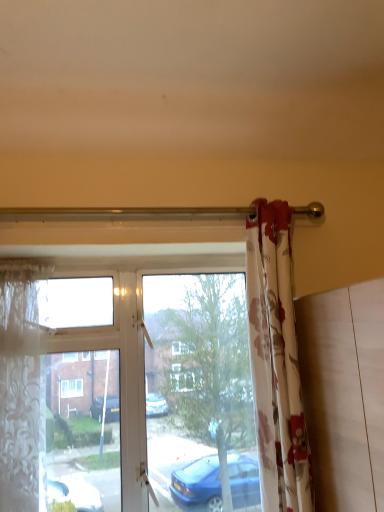
Question: Are transparent glass window at center and translucent floral fabric at left, arranged as the 2th curtain when viewed from the right, making contact?

Choices:
 (A) no
 (B) yes

Answer: (A)

Question: Is transparent glass window at center bigger than translucent floral fabric at left, the first curtain when ordered from left to right?

Choices:
 (A) yes
 (B) no

Answer: (A)

Question: From the image's perspective, is transparent glass window at center over translucent floral fabric at left, the first curtain when ordered from left to right?

Choices:
 (A) yes
 (B) no

Answer: (B)

Question: Considering the relative positions of transparent glass window at center and translucent floral fabric at left, the first curtain when ordered from left to right, in the image provided, is transparent glass window at center to the left of translucent floral fabric at left, the first curtain when ordered from left to right, from the viewer's perspective?

Choices:
 (A) yes
 (B) no

Answer: (B)

Question: Is transparent glass window at center surrounding translucent floral fabric at left, arranged as the 2th curtain when viewed from the right?

Choices:
 (A) no
 (B) yes

Answer: (B)

Question: Would you say transparent glass window at center is a long distance from translucent floral fabric at left, arranged as the 2th curtain when viewed from the right?

Choices:
 (A) no
 (B) yes

Answer: (A)

Question: Could translucent floral fabric at left, arranged as the 2th curtain when viewed from the right, be considered to be inside floral fabric curtain at right, the 2th curtain from the left?

Choices:
 (A) yes
 (B) no

Answer: (B)

Question: Is floral fabric curtain at right, placed as the first curtain when sorted from right to left, not within translucent floral fabric at left, the first curtain when ordered from left to right?

Choices:
 (A) no
 (B) yes

Answer: (B)

Question: Does floral fabric curtain at right, placed as the first curtain when sorted from right to left, have a greater width compared to translucent floral fabric at left, the first curtain when ordered from left to right?

Choices:
 (A) yes
 (B) no

Answer: (A)

Question: Considering the relative sizes of floral fabric curtain at right, the 2th curtain from the left, and translucent floral fabric at left, arranged as the 2th curtain when viewed from the right, in the image provided, is floral fabric curtain at right, the 2th curtain from the left, taller than translucent floral fabric at left, arranged as the 2th curtain when viewed from the right,?

Choices:
 (A) no
 (B) yes

Answer: (B)

Question: Can you confirm if floral fabric curtain at right, the 2th curtain from the left, is bigger than translucent floral fabric at left, the first curtain when ordered from left to right?

Choices:
 (A) yes
 (B) no

Answer: (A)

Question: Are floral fabric curtain at right, placed as the first curtain when sorted from right to left, and translucent floral fabric at left, arranged as the 2th curtain when viewed from the right, beside each other?

Choices:
 (A) yes
 (B) no

Answer: (B)

Question: Can you confirm if translucent floral fabric at left, arranged as the 2th curtain when viewed from the right, is taller than floral fabric curtain at right, the 2th curtain from the left?

Choices:
 (A) no
 (B) yes

Answer: (A)